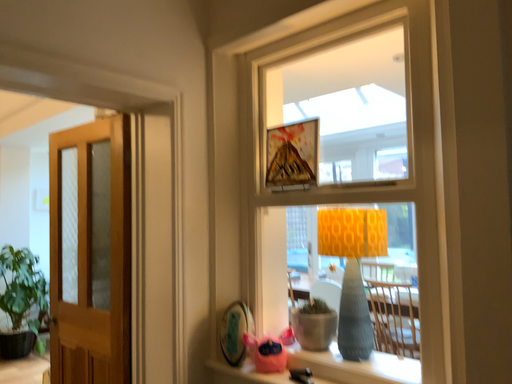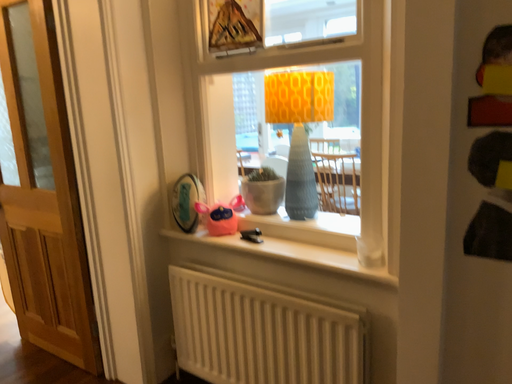
Question: How did the camera likely rotate when shooting the video?

Choices:
 (A) rotated left
 (B) rotated right

Answer: (B)